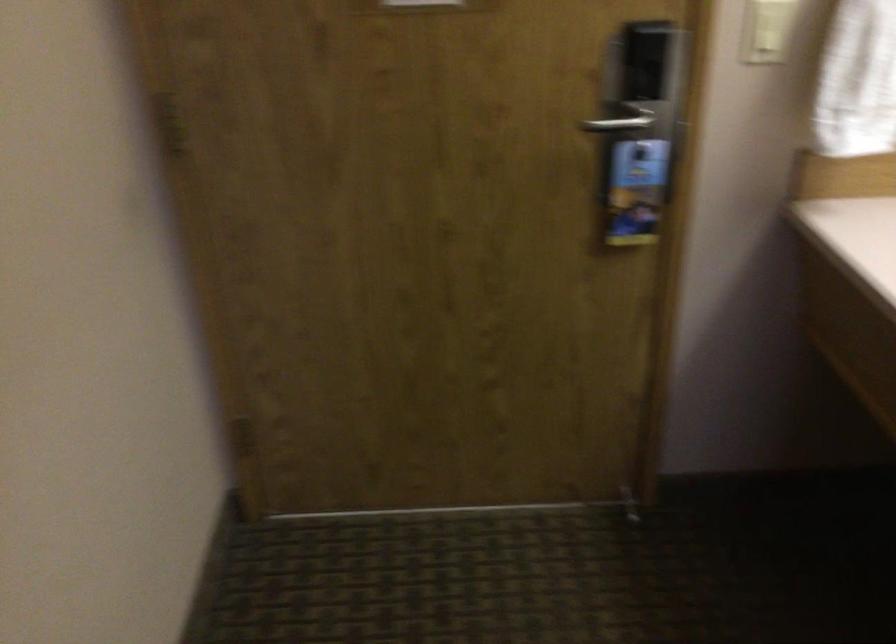
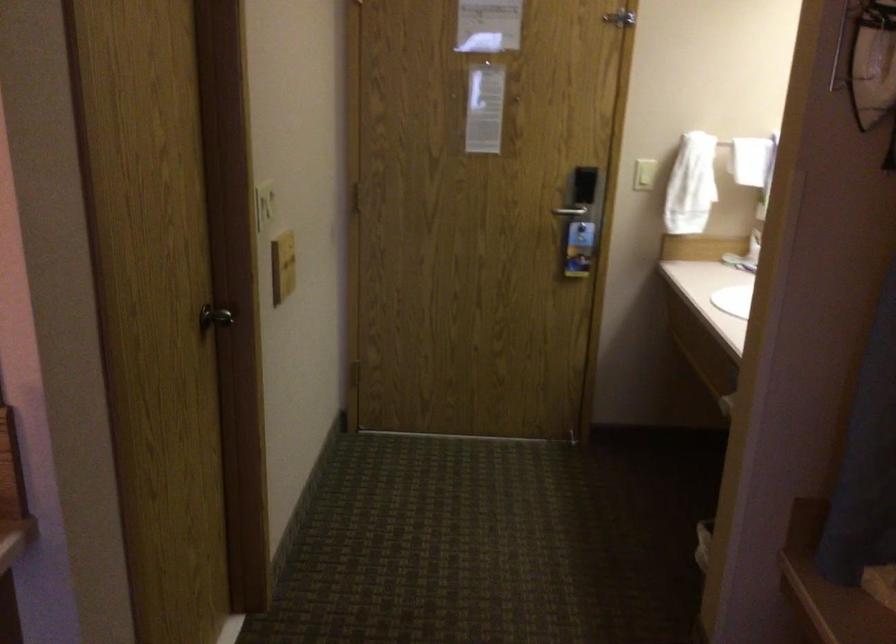
Question: What movement of the cameraman would produce the second image?

Choices:
 (A) Left
 (B) Right
 (C) Forward
 (D) Backward

Answer: (D)